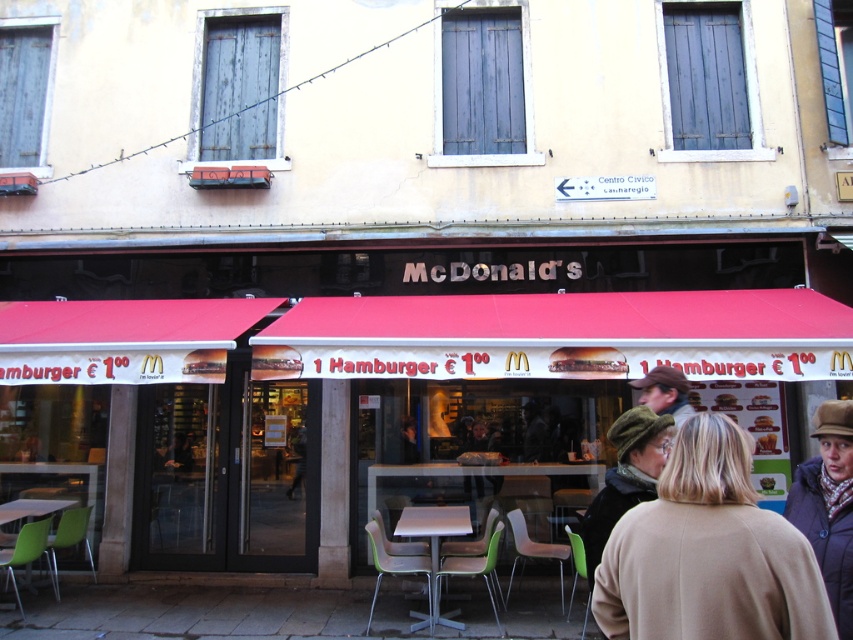
You are standing outside the McDonalds in the European city and want to take a photo of the entrance. The entrance is at point (817, 486). You also see a sign with the price of the hamburger at point (463, 531). Which point should you focus on first to ensure both the entrance and the sign are in your photo?

You should focus on point (817, 486) first because it is closer to the viewer than point (463, 531). This way, both the entrance and the sign will be in focus when taking the photo.

You are a customer looking to place your hat on the table in the McDonalds restaurant. Can the brown woolen hat at upper right fit on the metallic gray table at center?

The brown woolen hat at upper right is thinner than the metallic gray table at center, so the hat can fit on the table since it is thinner than the table.

You are a tourist in Venice and want to take a photo of the green felt hat at center and the green plastic table at lower left. If you stand in front of the McDonalds entrance, which object should you look to your left to capture in the frame?

The green plastic table at lower left is to the left of the green felt hat at center, so you should look to your left to capture the green plastic table at lower left in the frame.